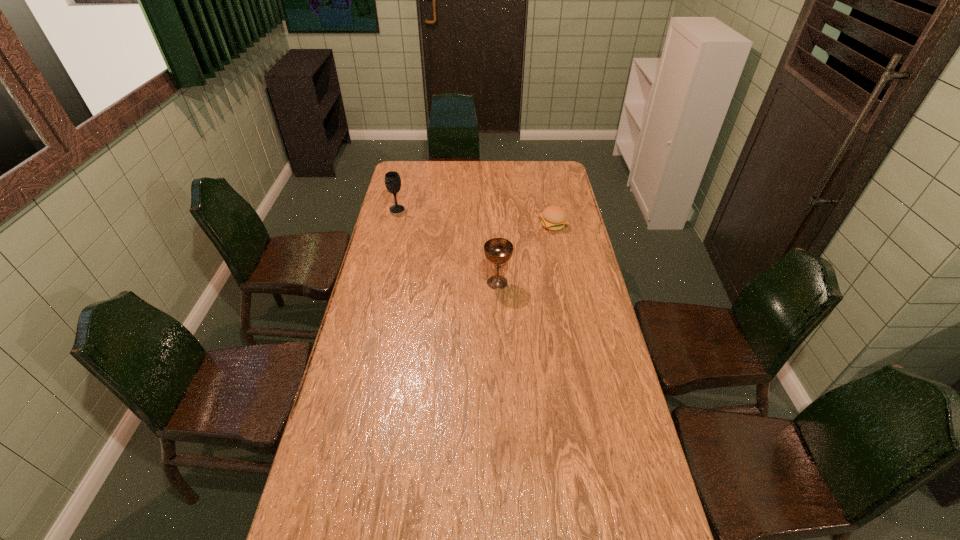
Locate an element on the screen. the farthest object is located at coordinates (392, 179).

You are a GUI agent. You are given a task and a screenshot of the screen. Output one action in this format:
    pyautogui.click(x=<x>, y=<y>)
    Task: Click on the leftmost object
    Image resolution: width=960 pixels, height=540 pixels.
    Given the screenshot: What is the action you would take?
    pyautogui.click(x=392, y=179)

Locate an element on the screen. the second object from left to right is located at coordinates (498, 251).

The width and height of the screenshot is (960, 540). Identify the location of the nearest object. (498, 251).

Identify the location of hamburger. (554, 218).

Where is `the rightmost object`? This screenshot has height=540, width=960. the rightmost object is located at coordinates (554, 218).

Identify the location of free space located 0.050m on the front of the farthest object. (395, 220).

Where is `vacant space located on the back of the nearest object`? The height and width of the screenshot is (540, 960). vacant space located on the back of the nearest object is located at coordinates (495, 223).

The image size is (960, 540). Find the location of `free space located 0.070m on the front of the shortest object`. free space located 0.070m on the front of the shortest object is located at coordinates (557, 244).

The image size is (960, 540). Identify the location of object located at the left edge. (392, 179).